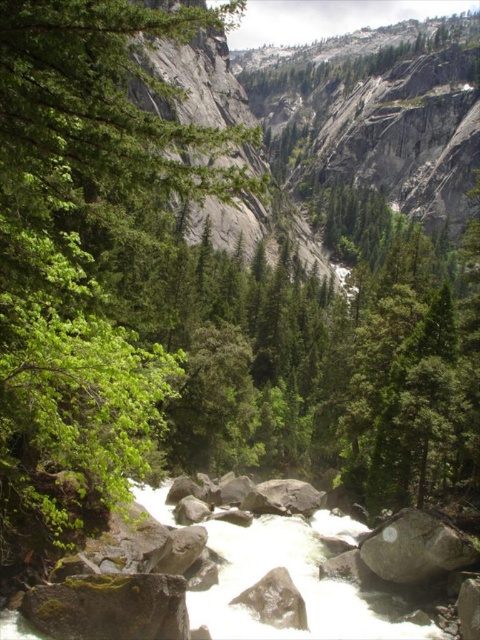
Question: Can you confirm if green leafy tree at left is positioned above mossy rock at lower left?

Choices:
 (A) yes
 (B) no

Answer: (A)

Question: Among these points, which one is nearest to the camera?

Choices:
 (A) (91, 630)
 (B) (11, 186)
 (C) (408, 515)

Answer: (B)

Question: Is green leafy tree at left positioned before gray rough boulder at center?

Choices:
 (A) no
 (B) yes

Answer: (B)

Question: Which of these objects is positioned farthest from the green leafy tree at left?

Choices:
 (A) mossy rock at lower left
 (B) gray rough boulder at center

Answer: (B)

Question: Is green leafy tree at left to the right of gray rough boulder at center from the viewer's perspective?

Choices:
 (A) no
 (B) yes

Answer: (A)

Question: Estimate the real-world distances between objects in this image. Which object is farther from the green leafy tree at left?

Choices:
 (A) mossy rock at lower left
 (B) gray rough boulder at center

Answer: (B)